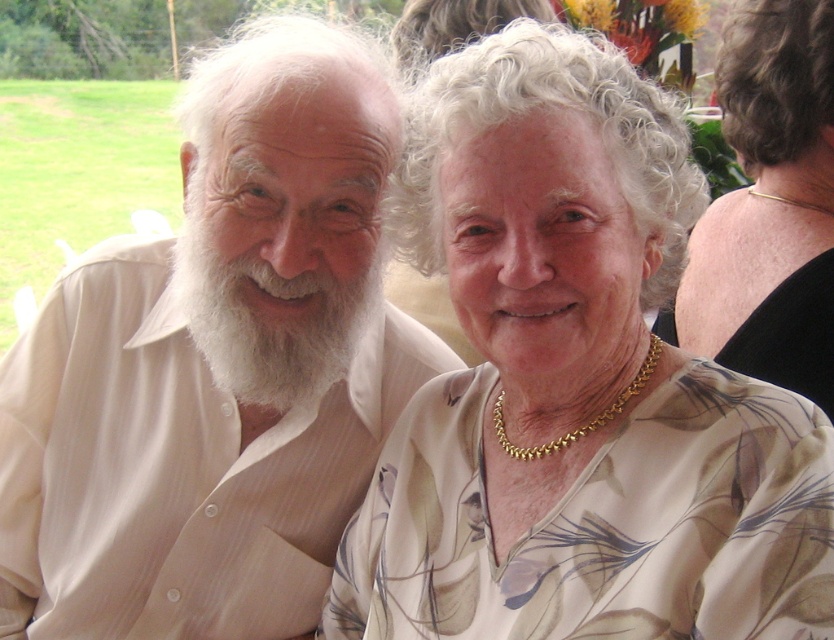
You are standing in a garden and see two points marked in the scene. The first point is at coordinates point (739, 584) and the second is at point (229, 312). Which of these two points is closer to you?

Point (739, 584) is closer to the viewer than point (229, 312).

You are a photographer taking a picture of the elderly couple in the garden. You notice the white floral blouse at center and the gold necklace at upper right. Which object is positioned lower in the image?

The white floral blouse at center is positioned below the gold necklace at upper right, so it is lower in the image.